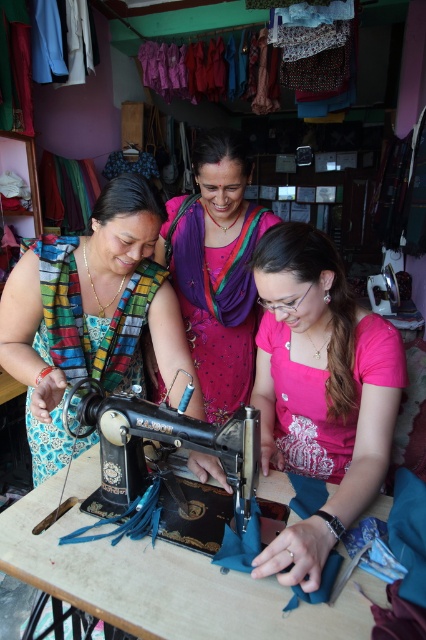
You are a customer in the tailor shop and want to place a large fabric roll on the wooden table at center. Given that the pink satin saree at center is already on the table, will there be enough space for the fabric roll?

The wooden table at center is smaller than the pink satin saree at center, so placing another large fabric roll on the table may not be feasible due to limited space.

You are a customer in the sewing workshop and want to place an order for a new saree. Where exactly is the pink satin saree at center located in the workshop?

The pink satin saree at center is located at point (216, 268) in the workshop.